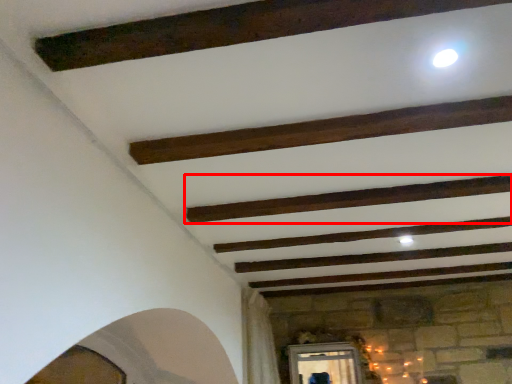
Question: In this image, where is plank (annotated by the red box) located relative to plank?

Choices:
 (A) left
 (B) right

Answer: (B)